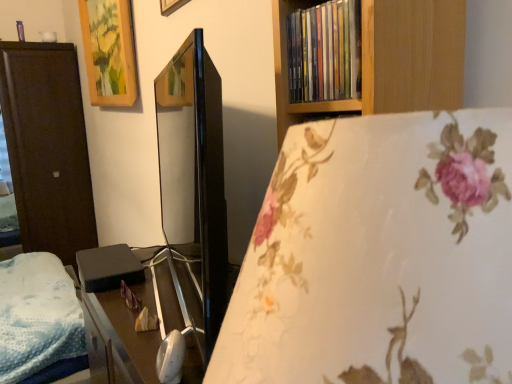
Question: From the image's perspective, would you say black matte/black box at left is shown under wooden picture frame at upper left?

Choices:
 (A) no
 (B) yes

Answer: (B)

Question: Does black matte/black box at left have a lesser height compared to wooden picture frame at upper left?

Choices:
 (A) yes
 (B) no

Answer: (A)

Question: From the image's perspective, is black matte/black box at left on wooden picture frame at upper left?

Choices:
 (A) yes
 (B) no

Answer: (B)

Question: Does black matte/black box at left come behind wooden picture frame at upper left?

Choices:
 (A) yes
 (B) no

Answer: (B)

Question: Is wooden picture frame at upper left at the back of black matte/black box at left?

Choices:
 (A) no
 (B) yes

Answer: (A)

Question: Is black matte/black box at left bigger than wooden picture frame at upper left?

Choices:
 (A) no
 (B) yes

Answer: (A)

Question: Does black glossy table at center appear on the left side of dark wood wardrobe at left?

Choices:
 (A) no
 (B) yes

Answer: (A)

Question: Are black glossy table at center and dark wood wardrobe at left far apart?

Choices:
 (A) no
 (B) yes

Answer: (B)

Question: Considering the relative sizes of black glossy table at center and dark wood wardrobe at left in the image provided, is black glossy table at center shorter than dark wood wardrobe at left?

Choices:
 (A) no
 (B) yes

Answer: (B)

Question: Can you confirm if black glossy table at center is bigger than dark wood wardrobe at left?

Choices:
 (A) no
 (B) yes

Answer: (A)

Question: Is black glossy table at center outside of dark wood wardrobe at left?

Choices:
 (A) no
 (B) yes

Answer: (B)

Question: From a real-world perspective, is black glossy table at center physically above dark wood wardrobe at left?

Choices:
 (A) no
 (B) yes

Answer: (A)

Question: Is black matte/black box at left wider than dark wood wardrobe at left?

Choices:
 (A) no
 (B) yes

Answer: (A)